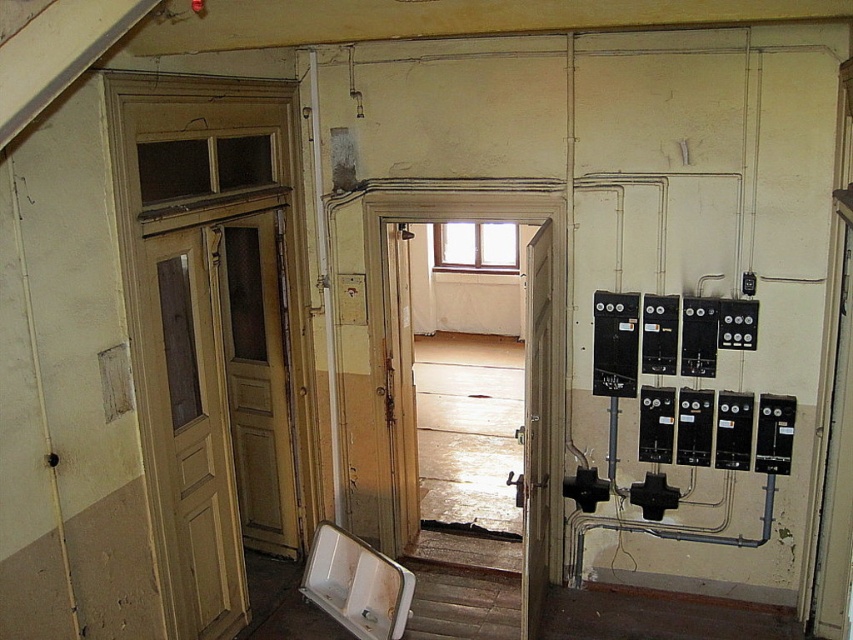
Is point (149, 406) farther from viewer compared to point (546, 474)?

No, it is in front of (546, 474).

This screenshot has height=640, width=853. Describe the element at coordinates (193, 433) in the screenshot. I see `light wood paneling at left` at that location.

Locate an element on the screen. The height and width of the screenshot is (640, 853). light wood paneling at left is located at coordinates tap(193, 433).

Can you confirm if light wood paneling at left is wider than white matte urinal at lower center?

No.

I want to click on light wood paneling at left, so click(x=193, y=433).

The image size is (853, 640). Identify the location of light wood paneling at left. (193, 433).

Between matte wood door at center and white matte urinal at lower center, which one has more height?

With more height is matte wood door at center.

Based on the photo, which of these two, matte wood door at center or white matte urinal at lower center, stands shorter?

white matte urinal at lower center is shorter.

Who is more forward, (531, 604) or (378, 598)?

Point (531, 604)

Locate an element on the screen. matte wood door at center is located at coordinates (537, 428).